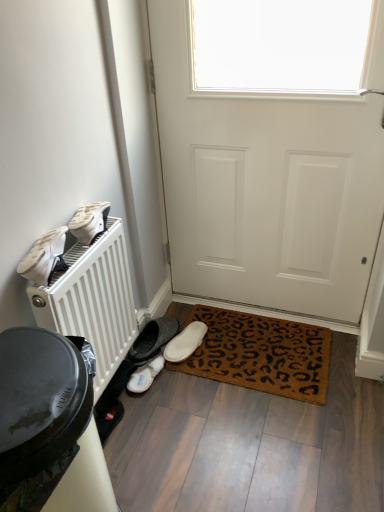
The height and width of the screenshot is (512, 384). Describe the element at coordinates (185, 342) in the screenshot. I see `white suede slipper at lower center, which is the 3th footwear from top to bottom` at that location.

What are the coordinates of `white matte shoe at left, which is counted as the 3th footwear, starting from the back` in the screenshot? It's located at (89, 221).

At what (x,y) coordinates should I click in order to perform the action: click on white plastic radiator at left. Please return your answer as a coordinate pair (x, y). Looking at the image, I should click on (93, 300).

This screenshot has height=512, width=384. Describe the element at coordinates (93, 300) in the screenshot. I see `white plastic radiator at left` at that location.

What are the coordinates of `white suede shoes at left, placed as the 2th footwear when sorted from top to bottom` in the screenshot? It's located at (44, 257).

Where is `white suede slipper at lower center, acting as the 1th footwear starting from the back`? The height and width of the screenshot is (512, 384). white suede slipper at lower center, acting as the 1th footwear starting from the back is located at coordinates (185, 342).

What's the angular difference between brown coir mat at lower center and black plastic trash can at lower left's facing directions?

93.1 degrees.

Which is less distant, (250, 377) or (28, 355)?

Point (250, 377) appears to be farther away from the viewer than point (28, 355).

Considering the relative positions of brown coir mat at lower center and black plastic trash can at lower left in the image provided, is brown coir mat at lower center to the left or to the right of black plastic trash can at lower left?

brown coir mat at lower center is positioned on black plastic trash can at lower left's right side.

I want to click on appliance located below the brown coir mat at lower center (from the image's perspective), so click(x=50, y=422).

From the picture: In terms of width, does white suede slipper at lower center, the second footwear ordered from the bottom, look wider or thinner when compared to white plastic radiator at left?

In the image, white suede slipper at lower center, the second footwear ordered from the bottom, appears to be wider than white plastic radiator at left.

Is white plastic radiator at left inside white suede slipper at lower center, which is the 3th footwear from top to bottom?

That's incorrect, white plastic radiator at left is not inside white suede slipper at lower center, which is the 3th footwear from top to bottom.

Is white suede slipper at lower center, placed as the 4th footwear when sorted from front to back, far from white plastic radiator at left?

white suede slipper at lower center, placed as the 4th footwear when sorted from front to back, is near white plastic radiator at left, not far away.

Is black plastic trash can at lower left turned away from brown coir mat at lower center?

No.

From the picture: Which point is more distant from viewer, (80, 461) or (204, 370)?

The point (204, 370) is behind.

Considering the relative sizes of black plastic trash can at lower left and brown coir mat at lower center in the image provided, is black plastic trash can at lower left shorter than brown coir mat at lower center?

No.

Is there a large distance between white matte door at center and black plastic trash can at lower left?

white matte door at center is positioned a significant distance from black plastic trash can at lower left.

Where is `door above the black plastic trash can at lower left (from a real-world perspective)`? The width and height of the screenshot is (384, 512). door above the black plastic trash can at lower left (from a real-world perspective) is located at coordinates (272, 149).

Considering the sizes of objects white matte door at center and black plastic trash can at lower left in the image provided, who is smaller, white matte door at center or black plastic trash can at lower left?

black plastic trash can at lower left.

Is white matte door at center outside of black plastic trash can at lower left?

Yes, white matte door at center is not within black plastic trash can at lower left.

There is a black plastic trash can at lower left. Where is `the 2nd footwear above it (from a real-world perspective)`? This screenshot has height=512, width=384. the 2nd footwear above it (from a real-world perspective) is located at coordinates (x=44, y=257).

Is white suede shoes at left, which is the 4th footwear from back to front, aimed at black plastic trash can at lower left?

No.

Is white suede shoes at left, placed as the 2th footwear when sorted from top to bottom, far from black plastic trash can at lower left?

No, white suede shoes at left, placed as the 2th footwear when sorted from top to bottom, is not far away from black plastic trash can at lower left.

Between white suede shoes at left, which is the first footwear from front to back, and black plastic trash can at lower left, which one appears on the right side from the viewer's perspective?

Positioned to the right is black plastic trash can at lower left.

Is white matte shoe at left, which is counted as the 3th footwear, starting from the back, positioned with its back to brown coir mat at lower center?

white matte shoe at left, which is counted as the 3th footwear, starting from the back, is not turned away from brown coir mat at lower center.

Relative to brown coir mat at lower center, is white matte shoe at left, which is counted as the 3th footwear, starting from the back, in front or behind?

In the image, white matte shoe at left, which is counted as the 3th footwear, starting from the back, appears in front of brown coir mat at lower center.

Which is correct: white matte shoe at left, which is counted as the 3th footwear, starting from the back, is inside brown coir mat at lower center, or outside of it?

white matte shoe at left, which is counted as the 3th footwear, starting from the back, is not enclosed by brown coir mat at lower center.

Identify the location of mat below the white matte shoe at left, which is the 4th footwear in bottom-to-top order (from the image's perspective). The width and height of the screenshot is (384, 512). (260, 354).

Image resolution: width=384 pixels, height=512 pixels. I want to click on mat above the white fluffy slippers at lower center, which ranks as the third footwear in front-to-back order (from the image's perspective), so point(260,354).

Looking at this image, is brown coir mat at lower center thinner than white fluffy slippers at lower center, which appears as the first footwear when ordered from the bottom?

Incorrect, the width of brown coir mat at lower center is not less than that of white fluffy slippers at lower center, which appears as the first footwear when ordered from the bottom.

Does point (292, 370) appear closer or farther from the camera than point (151, 381)?

Point (292, 370) is farther from the camera than point (151, 381).

Find the location of a particular element. The width and height of the screenshot is (384, 512). mat located on the right of black plastic trash can at lower left is located at coordinates (260, 354).

Where is `radiator above the white suede slipper at lower center, placed as the 4th footwear when sorted from front to back (from a real-world perspective)`? Image resolution: width=384 pixels, height=512 pixels. radiator above the white suede slipper at lower center, placed as the 4th footwear when sorted from front to back (from a real-world perspective) is located at coordinates (93, 300).

Estimate the real-world distances between objects in this image. Which object is closer to white matte door at center, black plastic trash can at lower left or white fluffy slippers at lower center, which appears as the first footwear when ordered from the bottom?

The object closer to white matte door at center is white fluffy slippers at lower center, which appears as the first footwear when ordered from the bottom.

Considering their positions, is brown coir mat at lower center positioned closer to white matte door at center than white plastic radiator at left?

Based on the image, brown coir mat at lower center appears to be nearer to white matte door at center.

Which object lies nearer to the anchor point white plastic radiator at left, white matte door at center or black plastic trash can at lower left?

black plastic trash can at lower left is closer to white plastic radiator at left.

Which object lies further to the anchor point white matte shoe at left, which appears as the second footwear when viewed from the front, brown coir mat at lower center or black plastic trash can at lower left?

brown coir mat at lower center lies further to white matte shoe at left, which appears as the second footwear when viewed from the front, than the other object.

In the scene shown: Looking at the image, which one is located closer to black plastic trash can at lower left, white matte shoe at left, which is the 4th footwear in bottom-to-top order, or white suede shoes at left, which is the first footwear from front to back?

white suede shoes at left, which is the first footwear from front to back, lies closer to black plastic trash can at lower left than the other object.

From the image, which object appears to be nearer to white suede slipper at lower center, acting as the 1th footwear starting from the back, white fluffy slippers at lower center, which appears as the first footwear when ordered from the bottom, or white plastic radiator at left?

white fluffy slippers at lower center, which appears as the first footwear when ordered from the bottom, is positioned closer to the anchor white suede slipper at lower center, acting as the 1th footwear starting from the back.

Considering their positions, is white suede slipper at lower center, acting as the 1th footwear starting from the back, positioned closer to black plastic trash can at lower left than white matte door at center?

white suede slipper at lower center, acting as the 1th footwear starting from the back, is positioned closer to the anchor black plastic trash can at lower left.

From the image, which object appears to be farther from black plastic trash can at lower left, brown coir mat at lower center or white plastic radiator at left?

brown coir mat at lower center is further to black plastic trash can at lower left.

I want to click on mat located between black plastic trash can at lower left and white suede slipper at lower center, the second footwear ordered from the bottom, in the depth direction, so click(260, 354).

The height and width of the screenshot is (512, 384). Find the location of `door positioned between white plastic radiator at left and white suede slipper at lower center, which is the 3th footwear from top to bottom, from near to far`. door positioned between white plastic radiator at left and white suede slipper at lower center, which is the 3th footwear from top to bottom, from near to far is located at coordinates (272, 149).

Image resolution: width=384 pixels, height=512 pixels. Identify the location of radiator between black plastic trash can at lower left and white fluffy slippers at lower center, which appears as the first footwear when ordered from the bottom, along the z-axis. tap(93, 300).

You are a GUI agent. You are given a task and a screenshot of the screen. Output one action in this format:
    pyautogui.click(x=<x>, y=<y>)
    Task: Click on the mat between white suede shoes at left, arranged as the third footwear when ordered from the bottom, and white fluffy slippers at lower center, acting as the fourth footwear starting from the top, along the z-axis
    
    Given the screenshot: What is the action you would take?
    pyautogui.click(x=260, y=354)